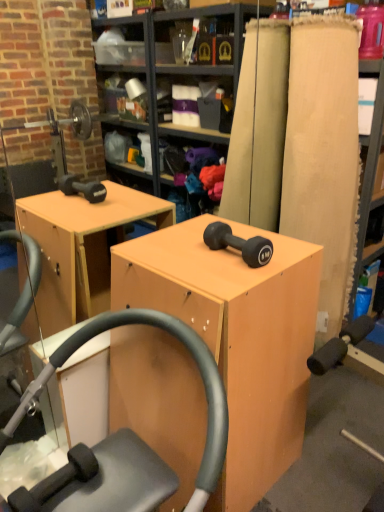
The width and height of the screenshot is (384, 512). Identify the location of free space to the left of matte black dumbbell at center. tap(182, 256).